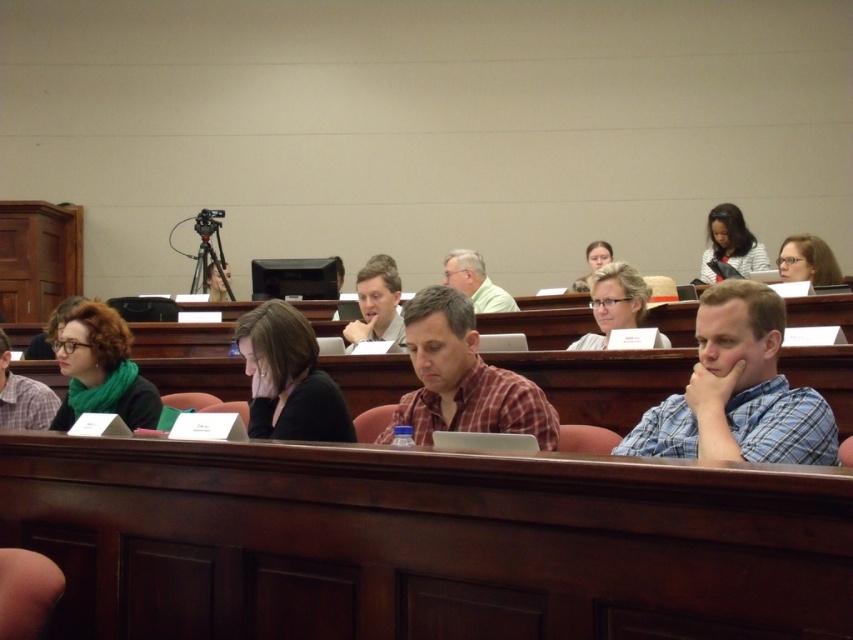
Can you confirm if matte black laptop at upper right is taller than green matte shirt at center?

Yes, matte black laptop at upper right is taller than green matte shirt at center.

Which is behind, point (750, 234) or point (460, 280)?

The point (750, 234) is more distant.

Is point (706, 228) closer to camera compared to point (469, 284)?

That is False.

Image resolution: width=853 pixels, height=640 pixels. I want to click on matte black laptop at upper right, so click(730, 243).

Between matte black laptop at upper right and matte black glasses at upper left, which one is positioned higher?

Positioned higher is matte black laptop at upper right.

Which of these two, matte black laptop at upper right or matte black glasses at upper left, stands shorter?

matte black glasses at upper left is shorter.

Which is in front, point (741, 241) or point (38, 342)?

Point (38, 342)

You are a GUI agent. You are given a task and a screenshot of the screen. Output one action in this format:
    pyautogui.click(x=<x>, y=<y>)
    Task: Click on the matte black laptop at upper right
    Image resolution: width=853 pixels, height=640 pixels.
    Given the screenshot: What is the action you would take?
    pyautogui.click(x=730, y=243)

Who is more forward, (131,420) or (612,326)?

Point (131,420) is in front.

Does point (129, 412) lie in front of point (606, 336)?

Yes, point (129, 412) is closer to viewer.

The width and height of the screenshot is (853, 640). I want to click on green scarf at left, so click(102, 369).